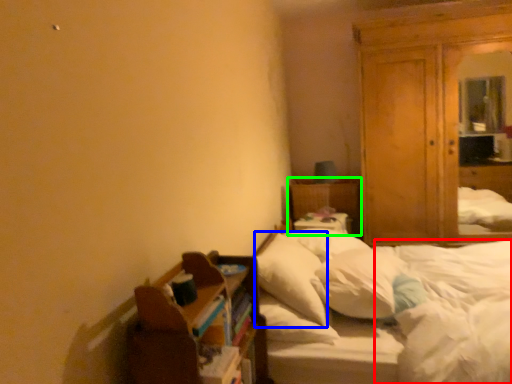
Question: Which object is the farthest from mattress (highlighted by a red box)? Choose among these: pillow (highlighted by a blue box) or bed frame (highlighted by a green box).

Choices:
 (A) pillow
 (B) bed frame

Answer: (B)